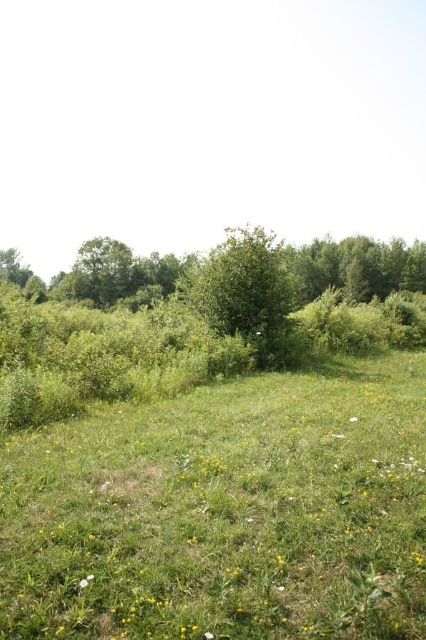
You are a hiker planning to walk from the green leafy tree at left to the green leafy tree at center in the grassy field. How far apart are these two trees?

The green leafy tree at center and green leafy tree at left are 20.21 meters apart from each other, so the distance between them is 20.21 meters.

You are planning to plant a new flower bed in the green grass at center and want to ensure it won not be overshadowed by the green leafy tree at center. Based on the scene, which object is smaller and therefore less likely to block sunlight?

The green grass at center is smaller than the green leafy tree at center, so it is less likely to block sunlight.

You are standing in the open grassy field and want to find a spot to place a picnic blanket. You notice the green grass at center and the green leafy tree at center. Which object is closer to the ground?

The green grass at center is below the green leafy tree at center, so the green grass at center is closer to the ground.